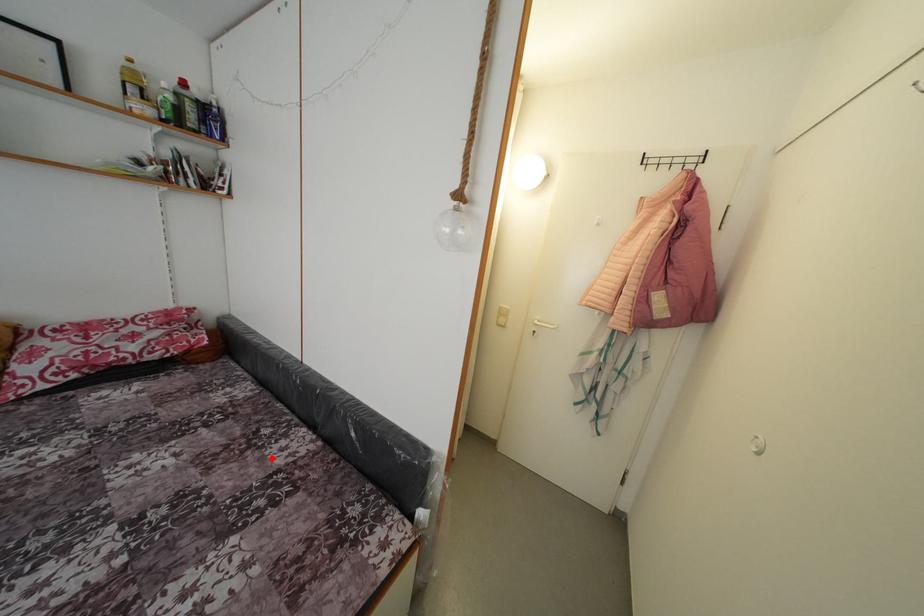
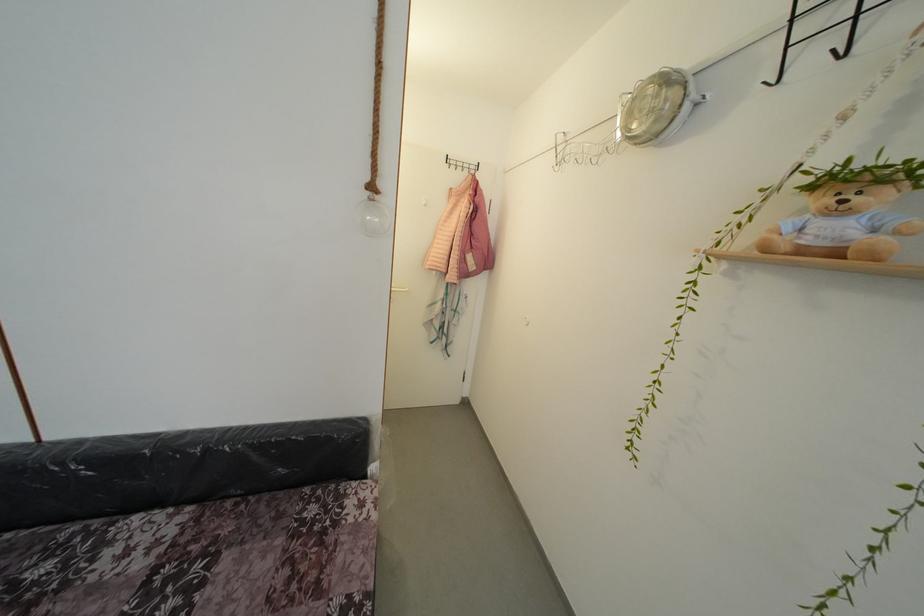
Locate, in the second image, the point that corresponds to the highlighted location in the first image.

(99, 585)